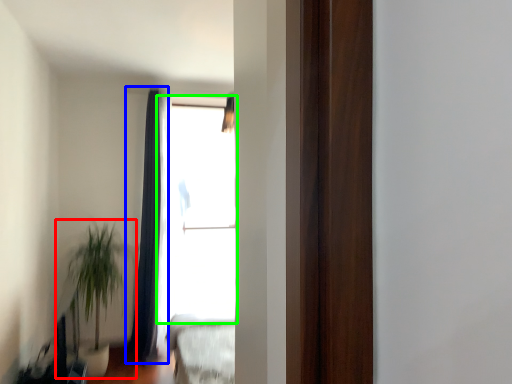
Question: Which object is the farthest from houseplant (highlighted by a red box)? Choose among these: curtain (highlighted by a blue box) or window (highlighted by a green box).

Choices:
 (A) curtain
 (B) window

Answer: (B)